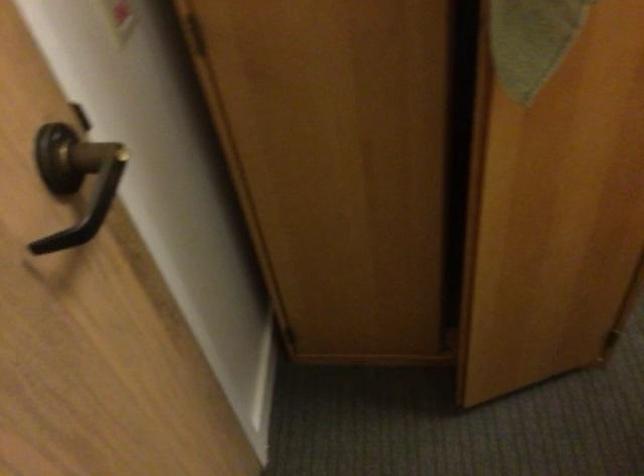
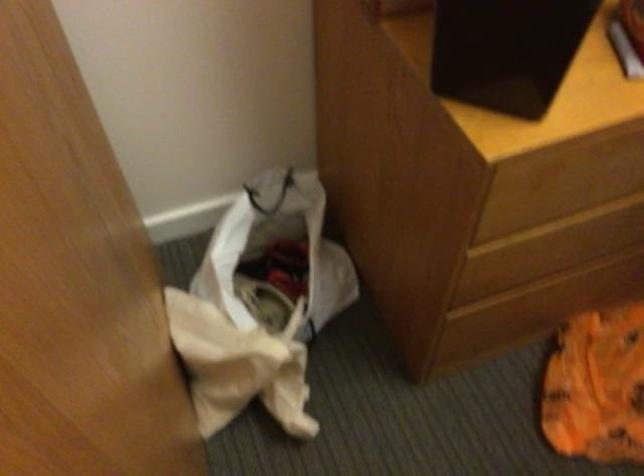
In a continuous first-person perspective shot, in which direction is the camera moving?

The movement direction of the cameraman is right, forward.